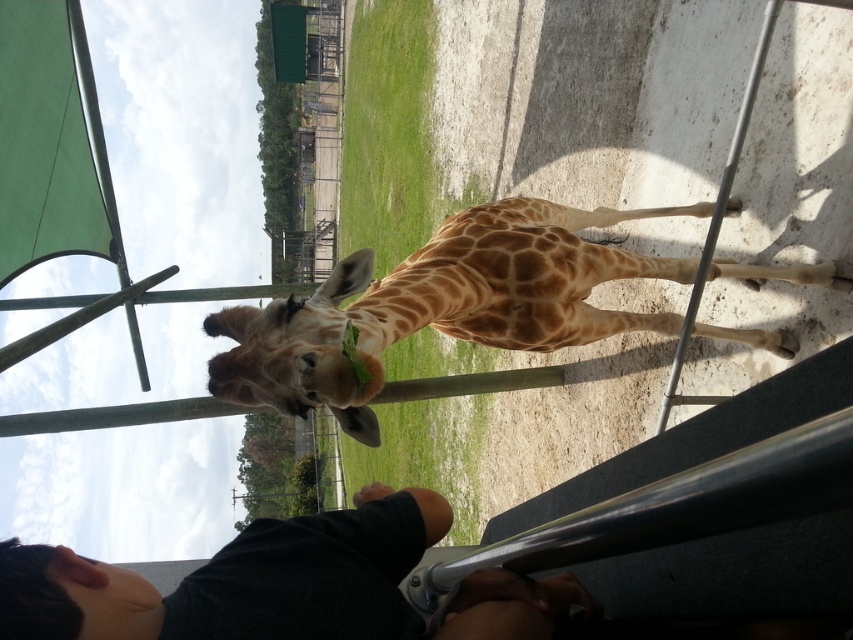
You are a zookeeper standing at the giraffe enclosure. You need to locate the black skin at lower left and the dark gray shirt at lower center. Which one is closer to you?

The dark gray shirt at lower center is closer to you because the black skin at lower left is behind it.

You are standing in the zoo and want to take a photo of both the giraffe and the person. The giraffe is at point (538, 234) and the person is at point (335, 518). Since you can only focus on one point at a time, which point should you focus on to ensure both subjects are in focus?

You should focus on point (538, 234) because it is closer to you than point (335, 518). This will ensure that both the giraffe and the person are in focus since the closer point will keep the farther one within the depth of field.

Consider the image. You are a zookeeper who wants to ensure the safety of both the giraffe and visitors. Given the spotted fur giraffe at center and the dark gray shirt at lower center, which object is larger and requires more space for safe interaction?

The spotted fur giraffe at center is bigger than the dark gray shirt at lower center, so it requires more space for safe interaction.